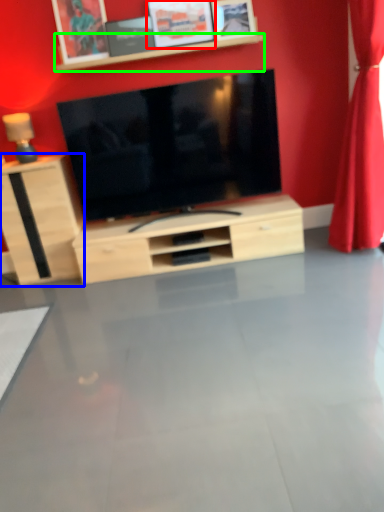
Question: Which object is positioned closest to picture frame (highlighted by a red box)? Select from cabinetry (highlighted by a blue box) and shelf (highlighted by a green box).

Choices:
 (A) cabinetry
 (B) shelf

Answer: (B)